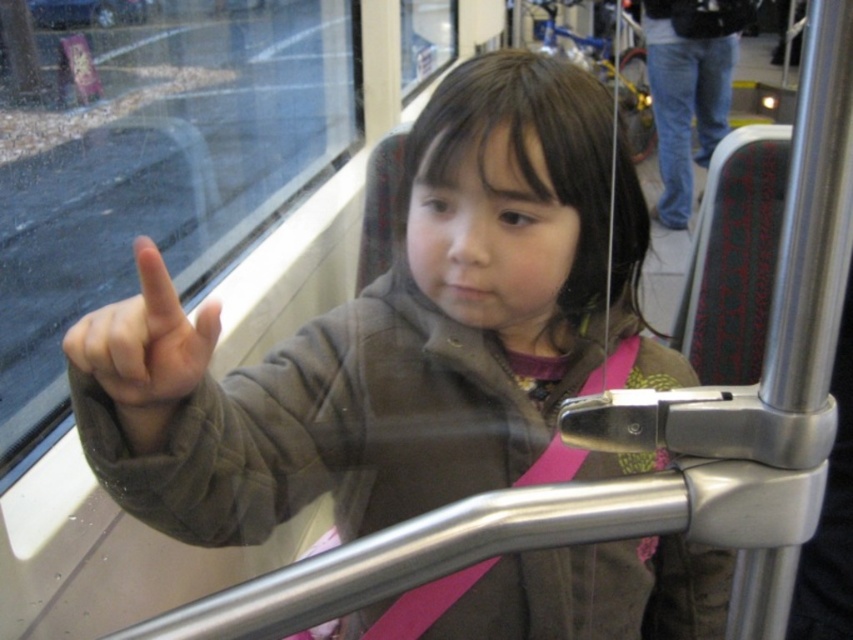
Question: Which of the following is the farthest from the observer?

Choices:
 (A) brown matte jacket at center
 (B) matte brown finger at upper left
 (C) jeans at upper right

Answer: (C)

Question: Can you confirm if brown matte jacket at center is positioned above matte brown finger at upper left?

Choices:
 (A) yes
 (B) no

Answer: (B)

Question: In this image, where is brown matte jacket at center located relative to matte brown finger at upper left?

Choices:
 (A) above
 (B) below

Answer: (B)

Question: Among these objects, which one is nearest to the camera?

Choices:
 (A) jeans at upper right
 (B) matte brown finger at upper left
 (C) brown matte jacket at center

Answer: (C)

Question: Observing the image, what is the correct spatial positioning of brown matte jacket at center in reference to matte brown finger at upper left?

Choices:
 (A) above
 (B) below

Answer: (B)

Question: Which object is positioned closest to the jeans at upper right?

Choices:
 (A) brown matte jacket at center
 (B) matte brown finger at upper left

Answer: (A)